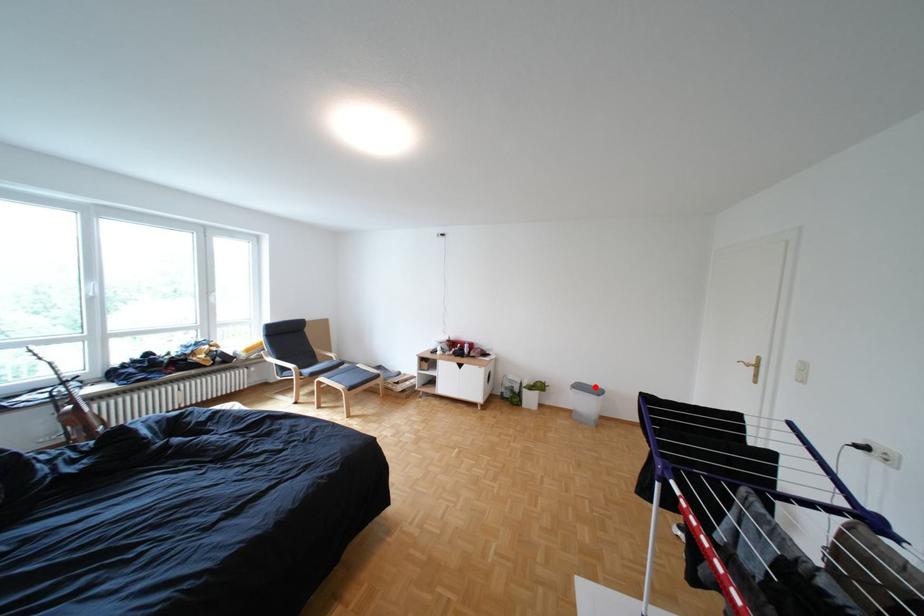
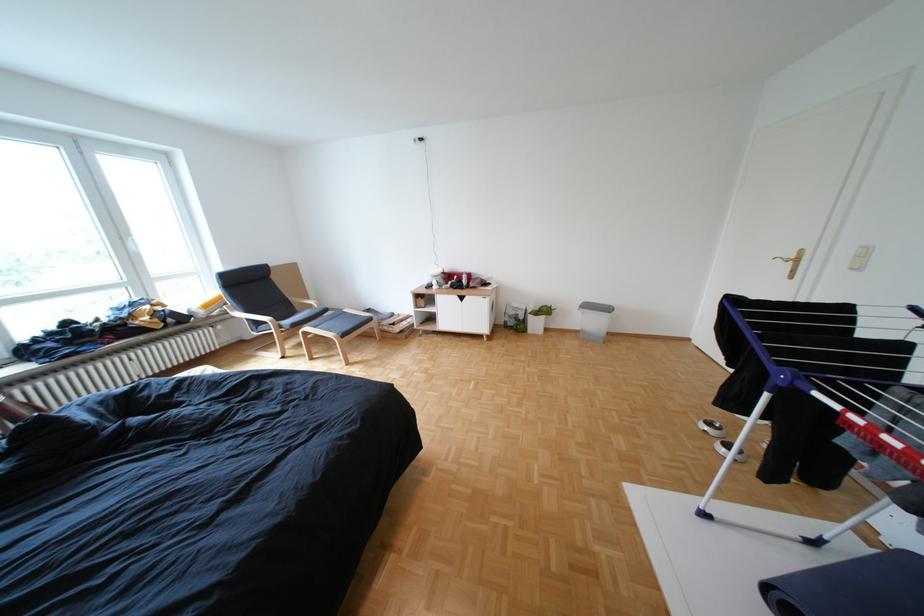
Find the pixel in the second image that matches the highlighted location in the first image.

(603, 306)